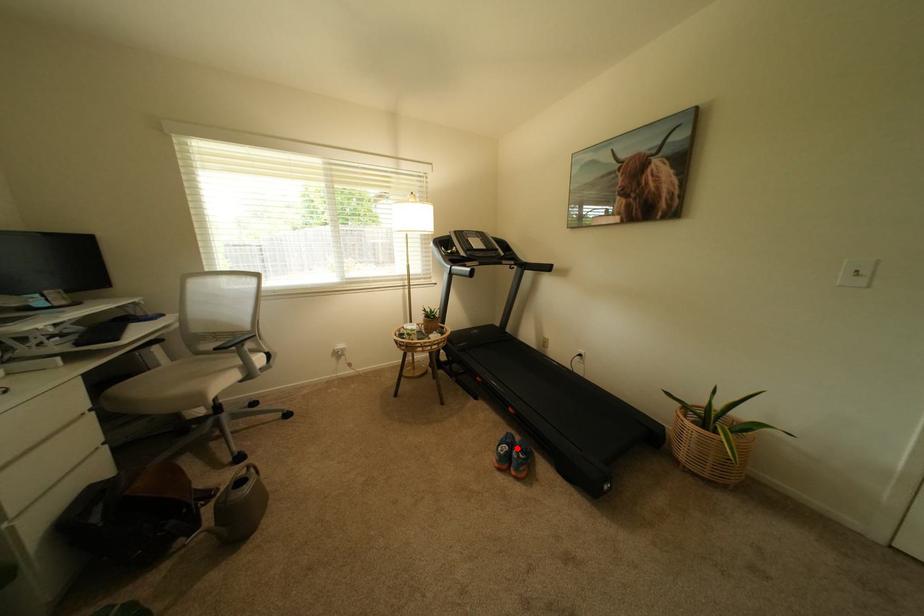
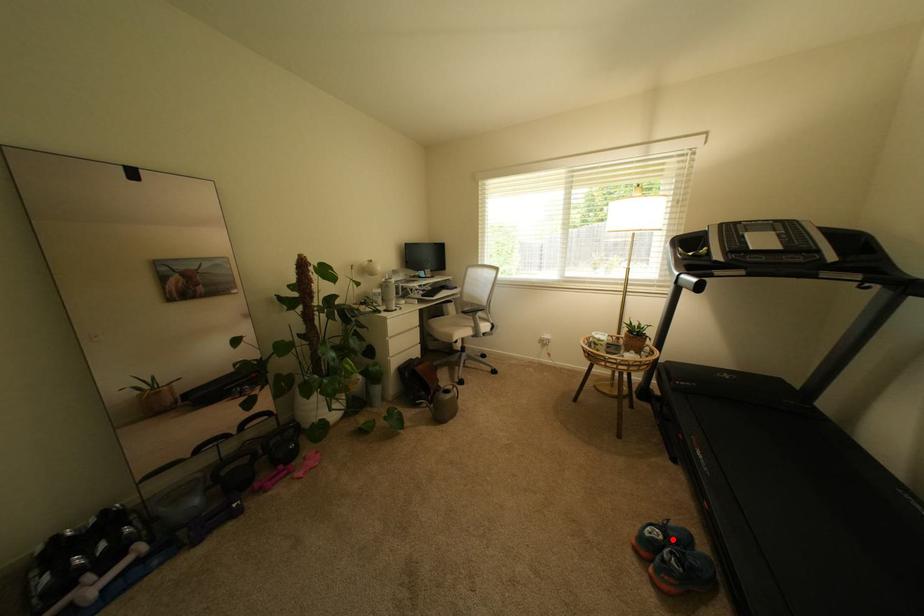
I am providing you with two images of the same scene from different viewpoints. A red point is marked on the first image and another point is marked on the second image. Does the point marked in image1 correspond to the same location as the one in image2?

Yes